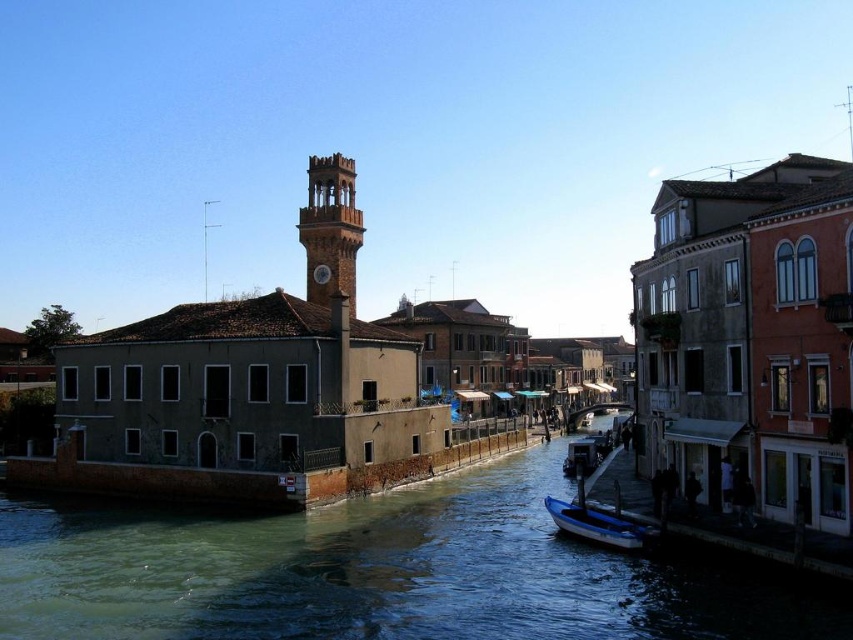
Question: Is greenish water at center wider than blue glossy boat at lower center?

Choices:
 (A) no
 (B) yes

Answer: (B)

Question: Does greenish water at center appear over brown stone clock tower at center?

Choices:
 (A) no
 (B) yes

Answer: (A)

Question: Which point appears farthest from the camera in this image?

Choices:
 (A) (99, 545)
 (B) (352, 160)
 (C) (572, 524)

Answer: (B)

Question: Which of the following is the farthest from the observer?

Choices:
 (A) (341, 204)
 (B) (646, 545)

Answer: (A)

Question: Which of the following is the closest to the observer?

Choices:
 (A) (573, 614)
 (B) (561, 500)

Answer: (A)

Question: Is greenish water at center bigger than blue glossy boat at lower center?

Choices:
 (A) no
 (B) yes

Answer: (B)